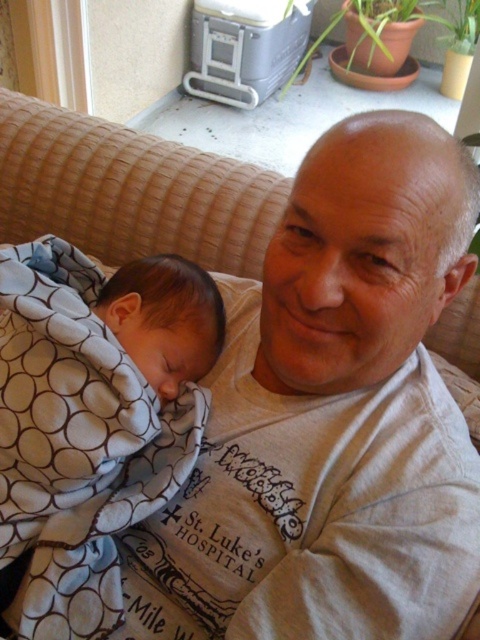
In the scene shown: Does white dotted fabric at left have a lesser width compared to soft blue blanket at lower left?

No, white dotted fabric at left is not thinner than soft blue blanket at lower left.

Which is more to the left, white dotted fabric at left or soft blue blanket at lower left?

white dotted fabric at left is more to the left.

Which is in front, point (173, 444) or point (112, 321)?

Positioned in front is point (173, 444).

The height and width of the screenshot is (640, 480). I want to click on white dotted fabric at left, so click(x=93, y=420).